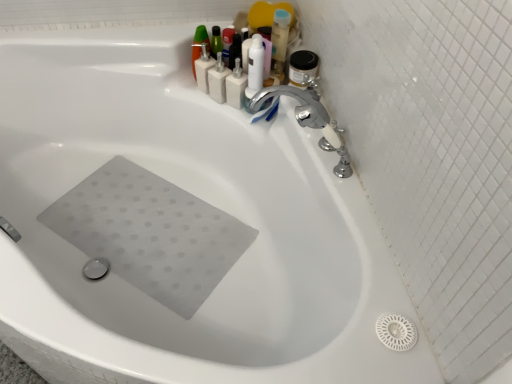
Describe the element at coordinates (236, 86) in the screenshot. This screenshot has width=512, height=384. I see `white plastic pump at upper center, which is counted as the 1th toiletry, starting from the right` at that location.

What do you see at coordinates (218, 80) in the screenshot? This screenshot has width=512, height=384. I see `white matte bottles at upper center, which is the 2th toiletry from left to right` at bounding box center [218, 80].

Describe the element at coordinates (296, 107) in the screenshot. I see `silver metallic faucet at upper right, the 2th tap viewed from the front` at that location.

In the scene shown: How much space does white plastic soap dispenser at upper center, marked as the first toiletry in a left-to-right arrangement, occupy horizontally?

white plastic soap dispenser at upper center, marked as the first toiletry in a left-to-right arrangement, is 3.40 inches in width.

Where is `chrome metallic faucet at upper right, which is counted as the 1th tap, starting from the front`? chrome metallic faucet at upper right, which is counted as the 1th tap, starting from the front is located at coordinates (308, 119).

Where is `the 1st toiletry above when counting from the white matte bottles at upper center, arranged as the 3th toiletry when viewed from the right (from the image's perspective)`? the 1st toiletry above when counting from the white matte bottles at upper center, arranged as the 3th toiletry when viewed from the right (from the image's perspective) is located at coordinates (203, 69).

Looking at this image, considering the positions of objects white matte bottles at upper center, which is the 2th toiletry from left to right, and white plastic soap dispenser at upper center, which ranks as the fourth toiletry in right-to-left order, in the image provided, who is more to the right, white matte bottles at upper center, which is the 2th toiletry from left to right, or white plastic soap dispenser at upper center, which ranks as the fourth toiletry in right-to-left order,?

white matte bottles at upper center, which is the 2th toiletry from left to right, is more to the right.

Looking at this image, is white matte bottles at upper center, which is the 2th toiletry from left to right, thinner than white plastic soap dispenser at upper center, marked as the first toiletry in a left-to-right arrangement?

In fact, white matte bottles at upper center, which is the 2th toiletry from left to right, might be wider than white plastic soap dispenser at upper center, marked as the first toiletry in a left-to-right arrangement.

Which point is more forward, (212, 79) or (204, 66)?

The point (212, 79) is more forward.

Which object is positioned more to the right, white plastic soap dispenser at upper center, marked as the first toiletry in a left-to-right arrangement, or chrome metallic faucet at upper right, which is counted as the 1th tap, starting from the front?

chrome metallic faucet at upper right, which is counted as the 1th tap, starting from the front.

From the image's perspective, which one is positioned higher, white plastic soap dispenser at upper center, marked as the first toiletry in a left-to-right arrangement, or chrome metallic faucet at upper right, the 2th tap from the back?

white plastic soap dispenser at upper center, marked as the first toiletry in a left-to-right arrangement.

From their relative heights in the image, would you say white plastic soap dispenser at upper center, marked as the first toiletry in a left-to-right arrangement, is taller or shorter than chrome metallic faucet at upper right, the 2th tap from the back?

In the image, white plastic soap dispenser at upper center, marked as the first toiletry in a left-to-right arrangement, appears to be shorter than chrome metallic faucet at upper right, the 2th tap from the back.

Is silver metallic faucet at upper right, the 2th tap viewed from the front, in front of or behind matte black pump bottle at upper center, arranged as the 2th toiletry when viewed from the right, in the image?

silver metallic faucet at upper right, the 2th tap viewed from the front, is in front of matte black pump bottle at upper center, arranged as the 2th toiletry when viewed from the right.

Considering the positions of points (272, 90) and (228, 57), is point (272, 90) closer to camera compared to point (228, 57)?

That is True.

Are silver metallic faucet at upper right, which is counted as the first tap, starting from the back, and matte black pump bottle at upper center, marked as the third toiletry in a left-to-right arrangement, located far from each other?

No, there isn't a large distance between silver metallic faucet at upper right, which is counted as the first tap, starting from the back, and matte black pump bottle at upper center, marked as the third toiletry in a left-to-right arrangement.

Considering the relative sizes of silver metallic faucet at upper right, the 2th tap viewed from the front, and matte black pump bottle at upper center, arranged as the 2th toiletry when viewed from the right, in the image provided, is silver metallic faucet at upper right, the 2th tap viewed from the front, thinner than matte black pump bottle at upper center, arranged as the 2th toiletry when viewed from the right,?

In fact, silver metallic faucet at upper right, the 2th tap viewed from the front, might be wider than matte black pump bottle at upper center, arranged as the 2th toiletry when viewed from the right.

Can you confirm if matte black pump bottle at upper center, marked as the third toiletry in a left-to-right arrangement, is wider than white matte bottles at upper center, arranged as the 3th toiletry when viewed from the right?

In fact, matte black pump bottle at upper center, marked as the third toiletry in a left-to-right arrangement, might be narrower than white matte bottles at upper center, arranged as the 3th toiletry when viewed from the right.

Can you tell me how much matte black pump bottle at upper center, arranged as the 2th toiletry when viewed from the right, and white matte bottles at upper center, arranged as the 3th toiletry when viewed from the right, differ in facing direction?

The angle between the facing direction of matte black pump bottle at upper center, arranged as the 2th toiletry when viewed from the right, and the facing direction of white matte bottles at upper center, arranged as the 3th toiletry when viewed from the right, is 0.0139 degrees.

Are matte black pump bottle at upper center, marked as the third toiletry in a left-to-right arrangement, and white matte bottles at upper center, arranged as the 3th toiletry when viewed from the right, beside each other?

Yes, matte black pump bottle at upper center, marked as the third toiletry in a left-to-right arrangement, is with white matte bottles at upper center, arranged as the 3th toiletry when viewed from the right.

From a real-world perspective, is matte black pump bottle at upper center, arranged as the 2th toiletry when viewed from the right, on top of white matte bottles at upper center, which is the 2th toiletry from left to right?

Yes.

Does point (243, 102) lie in front of point (201, 81)?

Yes, point (243, 102) is in front of point (201, 81).

Is white plastic pump at upper center, the fourth toiletry in the left-to-right sequence, positioned before white plastic soap dispenser at upper center, marked as the first toiletry in a left-to-right arrangement?

That is True.

Identify the location of toiletry that is the 2nd object located behind the white plastic pump at upper center, the fourth toiletry in the left-to-right sequence. This screenshot has height=384, width=512. (203, 69).

From a real-world perspective, which object stands above the other?

white plastic soap dispenser at upper center, which ranks as the fourth toiletry in right-to-left order.

Based on the photo, would you consider white plastic pump at upper center, the fourth toiletry in the left-to-right sequence, to be distant from silver metallic faucet at upper right, which is counted as the first tap, starting from the back?

No, white plastic pump at upper center, the fourth toiletry in the left-to-right sequence, is not far from silver metallic faucet at upper right, which is counted as the first tap, starting from the back.

From the picture: Is white plastic pump at upper center, which is counted as the 1th toiletry, starting from the right, turned away from silver metallic faucet at upper right, the 2th tap viewed from the front?

That's not correct — white plastic pump at upper center, which is counted as the 1th toiletry, starting from the right, is not looking away from silver metallic faucet at upper right, the 2th tap viewed from the front.

In terms of width, does white plastic pump at upper center, the fourth toiletry in the left-to-right sequence, look wider or thinner when compared to silver metallic faucet at upper right, the 2th tap viewed from the front?

Clearly, white plastic pump at upper center, the fourth toiletry in the left-to-right sequence, has less width compared to silver metallic faucet at upper right, the 2th tap viewed from the front.

Considering the positions of objects white plastic pump at upper center, which is counted as the 1th toiletry, starting from the right, and silver metallic faucet at upper right, the 2th tap viewed from the front, in the image provided, who is behind, white plastic pump at upper center, which is counted as the 1th toiletry, starting from the right, or silver metallic faucet at upper right, the 2th tap viewed from the front,?

white plastic pump at upper center, which is counted as the 1th toiletry, starting from the right, is behind.

Would you consider chrome metallic faucet at upper right, the 2th tap from the back, to be distant from matte black pump bottle at upper center, marked as the third toiletry in a left-to-right arrangement?

No, chrome metallic faucet at upper right, the 2th tap from the back, is in close proximity to matte black pump bottle at upper center, marked as the third toiletry in a left-to-right arrangement.

Based on their sizes in the image, would you say chrome metallic faucet at upper right, which is counted as the 1th tap, starting from the front, is bigger or smaller than matte black pump bottle at upper center, arranged as the 2th toiletry when viewed from the right?

Clearly, chrome metallic faucet at upper right, which is counted as the 1th tap, starting from the front, is larger in size than matte black pump bottle at upper center, arranged as the 2th toiletry when viewed from the right.

Which is less distant, (261, 97) or (228, 55)?

Positioned in front is point (261, 97).

I want to click on toiletry that is on the left side of white matte bottles at upper center, arranged as the 3th toiletry when viewed from the right, so click(x=203, y=69).

Where is `the 2nd toiletry directly beneath the chrome metallic faucet at upper right, which is counted as the 1th tap, starting from the front (from a real-world perspective)`? The width and height of the screenshot is (512, 384). the 2nd toiletry directly beneath the chrome metallic faucet at upper right, which is counted as the 1th tap, starting from the front (from a real-world perspective) is located at coordinates (203, 69).

When comparing their distances from silver metallic faucet at upper right, which is counted as the first tap, starting from the back, does white matte bottles at upper center, which is the 2th toiletry from left to right, or white plastic pump at upper center, which is counted as the 1th toiletry, starting from the right, seem further?

Based on the image, white matte bottles at upper center, which is the 2th toiletry from left to right, appears to be further to silver metallic faucet at upper right, which is counted as the first tap, starting from the back.

Based on their spatial positions, is white matte bottles at upper center, which is the 2th toiletry from left to right, or matte black pump bottle at upper center, marked as the third toiletry in a left-to-right arrangement, closer to silver metallic faucet at upper right, the 2th tap viewed from the front?

white matte bottles at upper center, which is the 2th toiletry from left to right, lies closer to silver metallic faucet at upper right, the 2th tap viewed from the front, than the other object.

When comparing their distances from white matte bottles at upper center, which is the 2th toiletry from left to right, does chrome metallic faucet at upper right, which is counted as the 1th tap, starting from the front, or matte black pump bottle at upper center, marked as the third toiletry in a left-to-right arrangement, seem closer?

matte black pump bottle at upper center, marked as the third toiletry in a left-to-right arrangement, is positioned closer to the anchor white matte bottles at upper center, which is the 2th toiletry from left to right.

Based on their spatial positions, is white matte bottles at upper center, which is the 2th toiletry from left to right, or chrome metallic faucet at upper right, which is counted as the 1th tap, starting from the front, further from silver metallic faucet at upper right, which is counted as the first tap, starting from the back?

white matte bottles at upper center, which is the 2th toiletry from left to right, lies further to silver metallic faucet at upper right, which is counted as the first tap, starting from the back, than the other object.

Looking at the image, which one is located closer to matte black pump bottle at upper center, marked as the third toiletry in a left-to-right arrangement, chrome metallic faucet at upper right, the 2th tap from the back, or white matte bottles at upper center, which is the 2th toiletry from left to right?

white matte bottles at upper center, which is the 2th toiletry from left to right, lies closer to matte black pump bottle at upper center, marked as the third toiletry in a left-to-right arrangement, than the other object.

Consider the image. When comparing their distances from white plastic soap dispenser at upper center, marked as the first toiletry in a left-to-right arrangement, does white matte bottles at upper center, which is the 2th toiletry from left to right, or white plastic pump at upper center, the fourth toiletry in the left-to-right sequence, seem closer?

The object closer to white plastic soap dispenser at upper center, marked as the first toiletry in a left-to-right arrangement, is white matte bottles at upper center, which is the 2th toiletry from left to right.

Based on their spatial positions, is matte black pump bottle at upper center, arranged as the 2th toiletry when viewed from the right, or white plastic soap dispenser at upper center, which ranks as the fourth toiletry in right-to-left order, further from white matte bottles at upper center, which is the 2th toiletry from left to right?

Among the two, matte black pump bottle at upper center, arranged as the 2th toiletry when viewed from the right, is located further to white matte bottles at upper center, which is the 2th toiletry from left to right.

Considering their positions, is white matte bottles at upper center, arranged as the 3th toiletry when viewed from the right, positioned closer to chrome metallic faucet at upper right, which is counted as the 1th tap, starting from the front, than white plastic soap dispenser at upper center, marked as the first toiletry in a left-to-right arrangement?

white matte bottles at upper center, arranged as the 3th toiletry when viewed from the right.

Locate an element on the screen. The image size is (512, 384). tap positioned between chrome metallic faucet at upper right, which is counted as the 1th tap, starting from the front, and white plastic soap dispenser at upper center, which ranks as the fourth toiletry in right-to-left order, from near to far is located at coordinates tap(296, 107).

Find the location of `toiletry located between silver metallic faucet at upper right, which is counted as the first tap, starting from the back, and white matte bottles at upper center, which is the 2th toiletry from left to right, in the depth direction`. toiletry located between silver metallic faucet at upper right, which is counted as the first tap, starting from the back, and white matte bottles at upper center, which is the 2th toiletry from left to right, in the depth direction is located at coordinates (236, 86).

The image size is (512, 384). In order to click on tap between chrome metallic faucet at upper right, the 2th tap from the back, and white matte bottles at upper center, arranged as the 3th toiletry when viewed from the right, from front to back in this screenshot , I will do `click(296, 107)`.

Identify the location of toiletry that lies between matte black pump bottle at upper center, marked as the third toiletry in a left-to-right arrangement, and white matte bottles at upper center, arranged as the 3th toiletry when viewed from the right, from top to bottom. (203, 69).